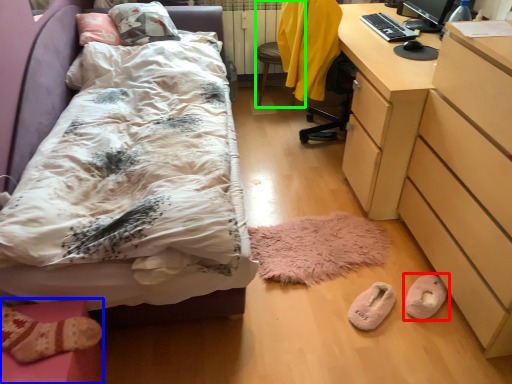
Question: Based on their relative distances, which object is farther from footwear (highlighted by a red box)? Choose from furniture (highlighted by a blue box) and swivel chair (highlighted by a green box).

Choices:
 (A) furniture
 (B) swivel chair

Answer: (B)